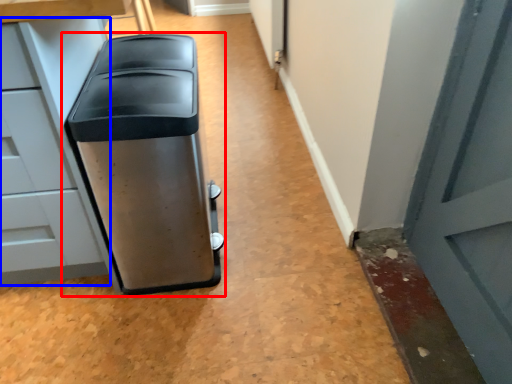
Question: Which of the following is the farthest to the observer, waste container (highlighted by a red box) or cabinetry (highlighted by a blue box)?

Choices:
 (A) waste container
 (B) cabinetry

Answer: (A)